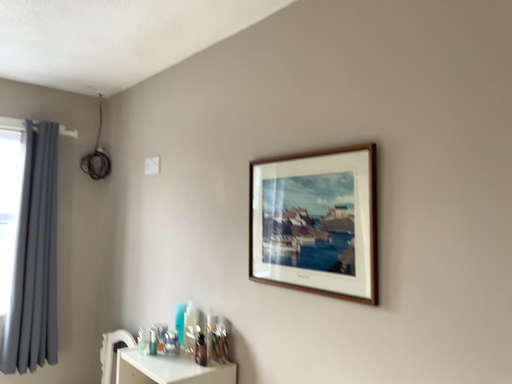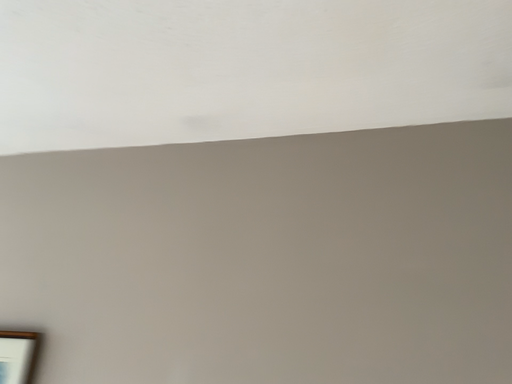
Question: Which way did the camera rotate in the video?

Choices:
 (A) rotated right
 (B) rotated left

Answer: (A)